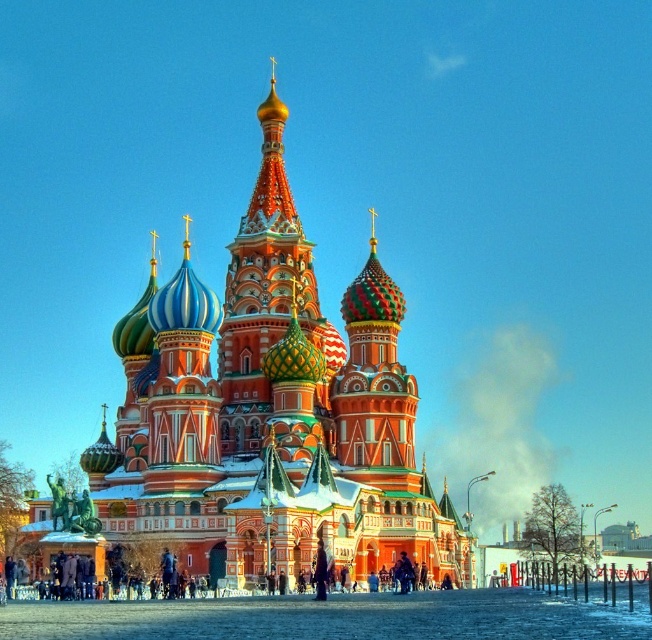
Question: Is polychrome mosaic church at center wider than polychrome mosaic dome at center?

Choices:
 (A) no
 (B) yes

Answer: (B)

Question: Is polychrome mosaic church at center bigger than polychrome mosaic dome at center?

Choices:
 (A) no
 (B) yes

Answer: (B)

Question: Is polychrome mosaic church at center thinner than polychrome mosaic dome at center?

Choices:
 (A) yes
 (B) no

Answer: (B)